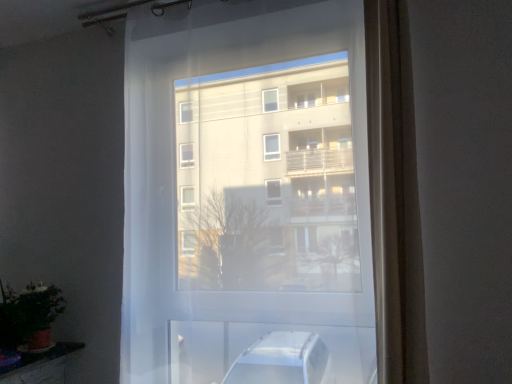
I want to click on green matte plant at lower left, so click(28, 312).

The image size is (512, 384). Find the location of `green matte plant at lower left`. green matte plant at lower left is located at coordinates (28, 312).

From a real-world perspective, is transparent fabric at center positioned above or below green matte plant at lower left?

transparent fabric at center is above green matte plant at lower left.

Which is less distant, (217, 79) or (38, 317)?

The point (217, 79) is closer to the camera.

Does transparent fabric at center have a smaller size compared to green matte plant at lower left?

No.

In the scene shown: In the image, is transparent fabric at center on the left side or the right side of green matte plant at lower left?

transparent fabric at center is positioned on green matte plant at lower left's right side.

Which object is more forward, green matte plant at lower left or transparent fabric at center?

Positioned in front is transparent fabric at center.

How many degrees apart are the facing directions of green matte plant at lower left and transparent fabric at center?

They differ by 2.84e-05 degrees in their facing directions.

Which is correct: green matte plant at lower left is inside transparent fabric at center, or outside of it?

green matte plant at lower left is not enclosed by transparent fabric at center.

How far apart are green matte plant at lower left and transparent fabric at center?

green matte plant at lower left is 89.39 centimeters away from transparent fabric at center.

Does satin beige curtain at right have a greater height compared to green matte plant at lower left?

Indeed, satin beige curtain at right has a greater height compared to green matte plant at lower left.

At what (x,y) coordinates should I click in order to perform the action: click on curtain in front of the green matte plant at lower left. Please return your answer as a coordinate pair (x, y). This screenshot has width=512, height=384. Looking at the image, I should click on coord(395,197).

Is satin beige curtain at right wider than green matte plant at lower left?

Correct, the width of satin beige curtain at right exceeds that of green matte plant at lower left.

Is satin beige curtain at right inside the boundaries of green matte plant at lower left, or outside?

satin beige curtain at right is spatially situated outside green matte plant at lower left.

From a real-world perspective, is green matte plant at lower left over satin beige curtain at right?

Actually, green matte plant at lower left is physically below satin beige curtain at right in the real world.

From the image's perspective, is green matte plant at lower left located above or below satin beige curtain at right?

green matte plant at lower left is below satin beige curtain at right.

Is green matte plant at lower left facing towards satin beige curtain at right?

No, green matte plant at lower left does not turn towards satin beige curtain at right.

Is green matte plant at lower left not within satin beige curtain at right?

green matte plant at lower left is positioned outside satin beige curtain at right.

Does transparent fabric at center have a lesser height compared to satin beige curtain at right?

No, transparent fabric at center is not shorter than satin beige curtain at right.

Is transparent fabric at center in contact with satin beige curtain at right?

No, transparent fabric at center is not next to satin beige curtain at right.

Is point (258, 301) positioned after point (418, 265)?

Yes, point (258, 301) is farther from viewer.

The width and height of the screenshot is (512, 384). I want to click on curtain in front of the transparent fabric at center, so click(395, 197).

From a real-world perspective, is satin beige curtain at right beneath transparent fabric at center?

Yes, from a real-world perspective, satin beige curtain at right is under transparent fabric at center.

Can you tell me how much satin beige curtain at right and transparent fabric at center differ in facing direction?

The facing directions of satin beige curtain at right and transparent fabric at center are 2.63e-05 degrees apart.

Is satin beige curtain at right directly adjacent to transparent fabric at center?

satin beige curtain at right is not next to transparent fabric at center, and they're not touching.

Which is correct: satin beige curtain at right is inside transparent fabric at center, or outside of it?

satin beige curtain at right cannot be found inside transparent fabric at center.

Locate an element on the screen. The image size is (512, 384). window located on the right of green matte plant at lower left is located at coordinates (251, 198).

Where is `window above the green matte plant at lower left (from a real-world perspective)`? This screenshot has height=384, width=512. window above the green matte plant at lower left (from a real-world perspective) is located at coordinates (251, 198).

When comparing their distances from green matte plant at lower left, does satin beige curtain at right or transparent fabric at center seem further?

satin beige curtain at right.

From the image, which object appears to be nearer to satin beige curtain at right, transparent fabric at center or green matte plant at lower left?

transparent fabric at center is closer to satin beige curtain at right.

Considering their positions, is green matte plant at lower left positioned further to transparent fabric at center than satin beige curtain at right?

Among the two, green matte plant at lower left is located further to transparent fabric at center.

Based on the photo, estimate the real-world distances between objects in this image. Which object is further from satin beige curtain at right, green matte plant at lower left or transparent fabric at center?

green matte plant at lower left lies further to satin beige curtain at right than the other object.

Based on their spatial positions, is satin beige curtain at right or green matte plant at lower left further from transparent fabric at center?

green matte plant at lower left is positioned further to the anchor transparent fabric at center.

Based on their spatial positions, is transparent fabric at center or satin beige curtain at right closer to green matte plant at lower left?

transparent fabric at center is positioned closer to the anchor green matte plant at lower left.

Locate an element on the screen. window situated between green matte plant at lower left and satin beige curtain at right from left to right is located at coordinates (251, 198).